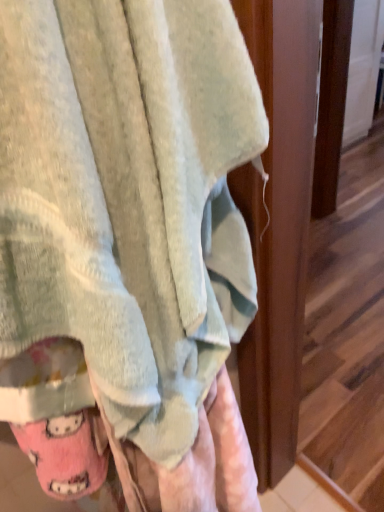
Measure the distance between point (x=111, y=53) and camera.

The distance of point (x=111, y=53) from camera is 12.72 inches.

Locate an element on the screen. The height and width of the screenshot is (512, 384). soft green towel at center is located at coordinates (123, 210).

What do you see at coordinates (123, 210) in the screenshot? I see `soft green towel at center` at bounding box center [123, 210].

This screenshot has width=384, height=512. Find the location of `soft green towel at center`. soft green towel at center is located at coordinates (123, 210).